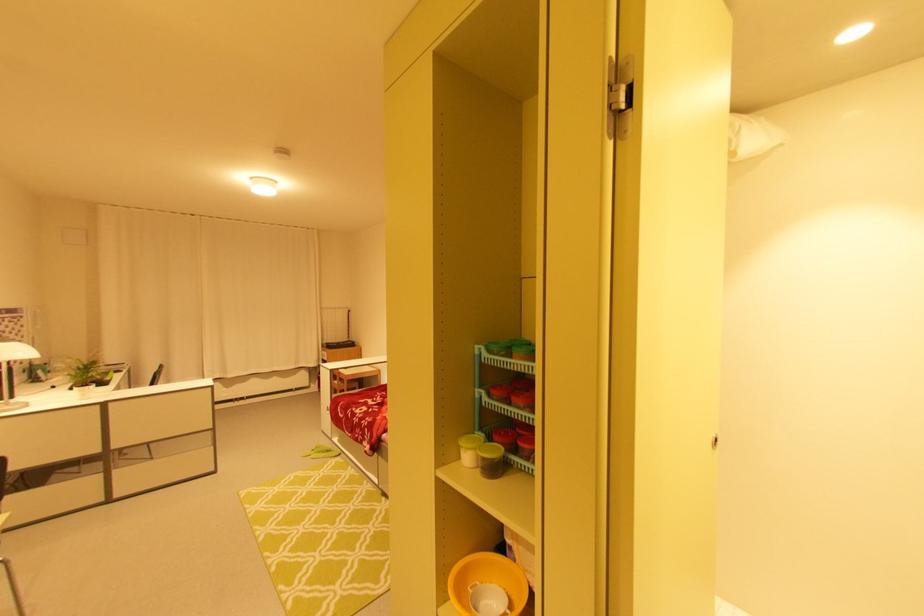
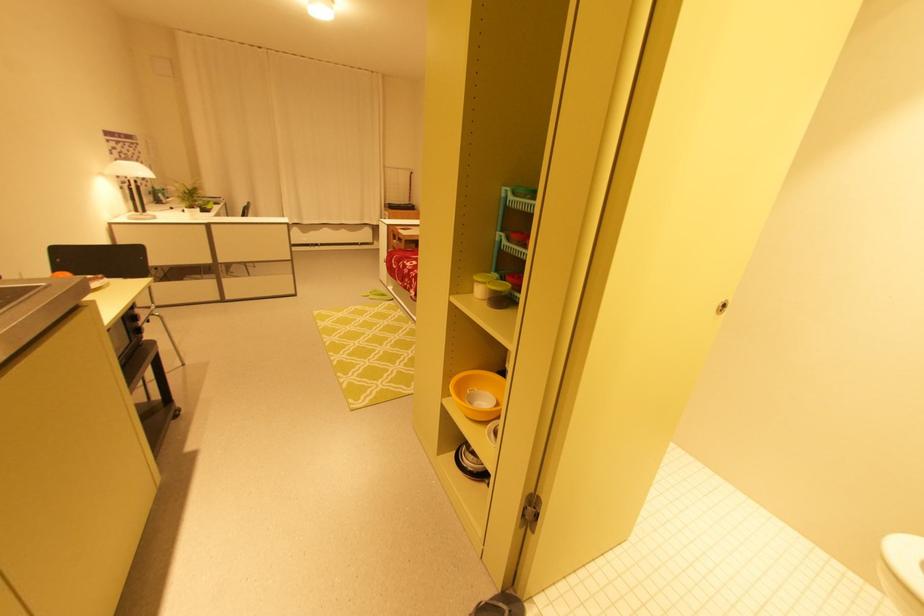
Locate, in the second image, the point that corresponds to point 464,459 in the first image.

(477, 293)